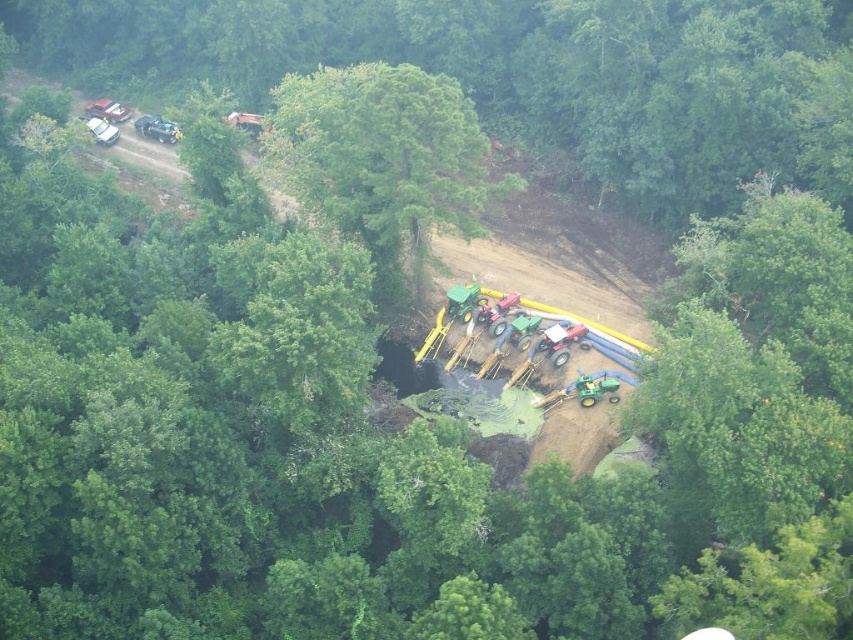
Question: Is green leafy tree at upper center bigger than green leafy tree at center?

Choices:
 (A) no
 (B) yes

Answer: (B)

Question: Is green leafy tree at upper center smaller than green leafy tree at center?

Choices:
 (A) no
 (B) yes

Answer: (A)

Question: Is green leafy tree at upper center wider than green leafy tree at center?

Choices:
 (A) yes
 (B) no

Answer: (A)

Question: Among these objects, which one is nearest to the camera?

Choices:
 (A) green leafy tree at center
 (B) green leafy tree at upper center

Answer: (A)